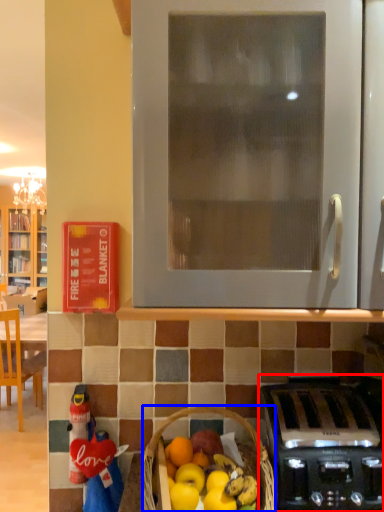
Question: Among these objects, which one is nearest to the camera, kitchen appliance (highlighted by a red box) or picnic basket (highlighted by a blue box)?

Choices:
 (A) kitchen appliance
 (B) picnic basket

Answer: (B)